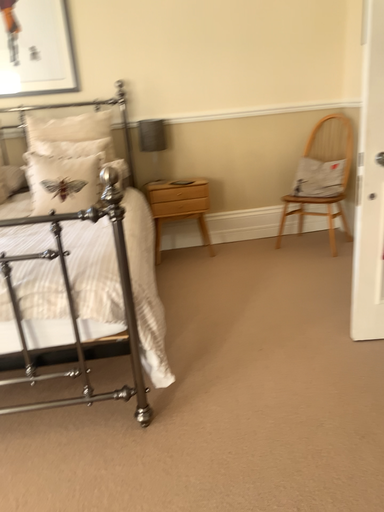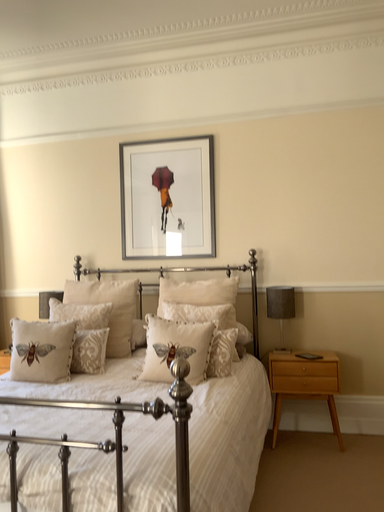
Question: Which way did the camera rotate in the video?

Choices:
 (A) rotated downward
 (B) rotated upward

Answer: (B)